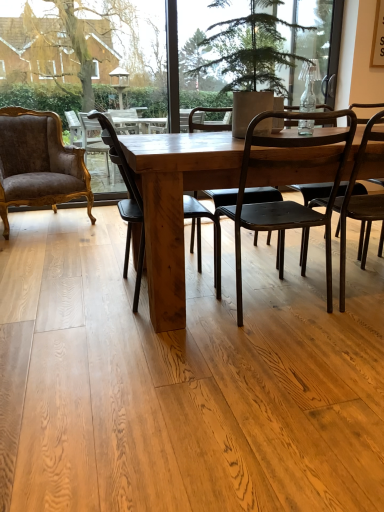
Question: From the image's perspective, is velvet brown armchair at left, acting as the 1th chair starting from the left, located above or below matte black chair at right, positioned as the 4th chair in left-to-right order?

Choices:
 (A) below
 (B) above

Answer: (B)

Question: Is velvet brown armchair at left, acting as the 1th chair starting from the left, wider or thinner than matte black chair at right, positioned as the 4th chair in left-to-right order?

Choices:
 (A) thin
 (B) wide

Answer: (B)

Question: Which object is positioned closest to the matte black chair at right, which ranks as the 1th chair in right-to-left order?

Choices:
 (A) velvet brown armchair at left, acting as the 1th chair starting from the left
 (B) wooden chair at center, positioned as the third chair in right-to-left order
 (C) green textured plant at center
 (D) matte black chair at center, which appears as the second chair when viewed from the right

Answer: (D)

Question: Considering the real-world distances, which object is farthest from the matte black chair at right, positioned as the 4th chair in left-to-right order?

Choices:
 (A) matte black chair at center, acting as the 3th chair starting from the left
 (B) wooden chair at center, which appears as the 2th chair when viewed from the left
 (C) green textured plant at center
 (D) velvet brown armchair at left, which is the fourth chair in right-to-left order

Answer: (D)